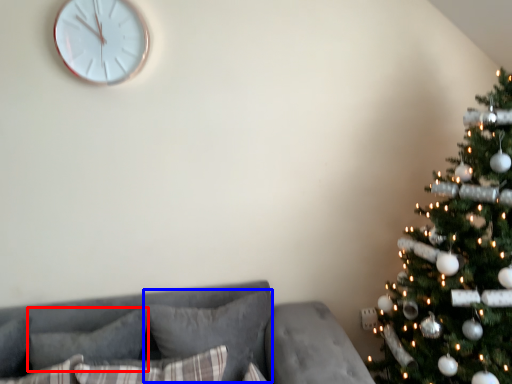
Question: Which of the following is the farthest to the observer, pillow (highlighted by a red box) or pillow (highlighted by a blue box)?

Choices:
 (A) pillow
 (B) pillow

Answer: (B)